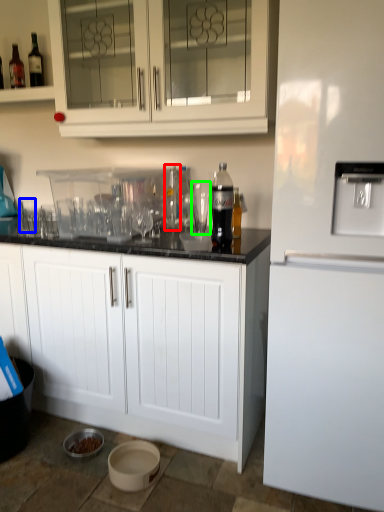
Question: Which is farther away from bottle (highlighted by a red box)? shot glass (highlighted by a blue box) or shot glass (highlighted by a green box)?

Choices:
 (A) shot glass
 (B) shot glass

Answer: (A)